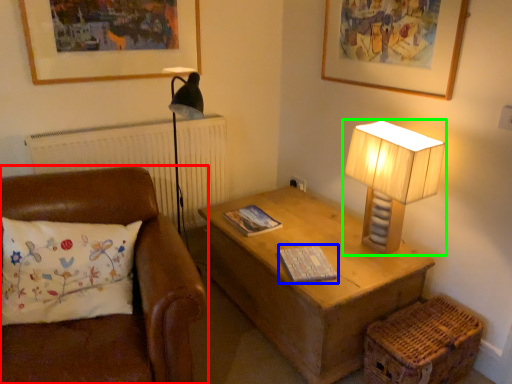
Question: Which is nearer to the studio couch (highlighted by a red box)? magazine (highlighted by a blue box) or lamp (highlighted by a green box).

Choices:
 (A) magazine
 (B) lamp

Answer: (A)